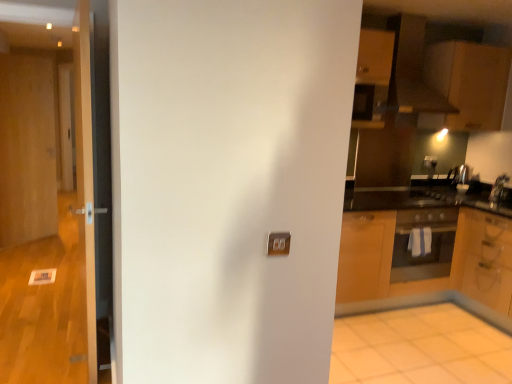
This screenshot has height=384, width=512. In order to click on blank space above matte brown exhaust hood at upper right (from a real-world perspective) in this screenshot , I will do `click(421, 10)`.